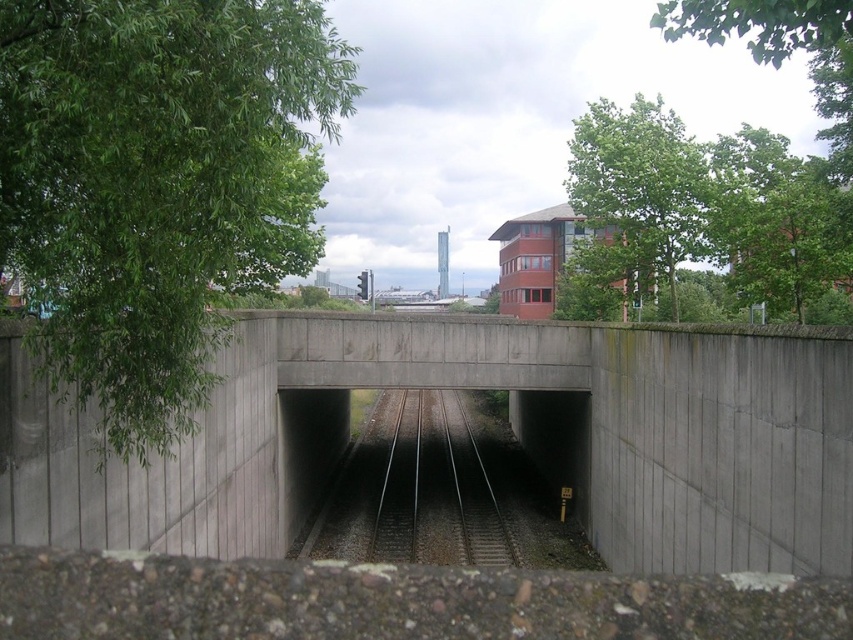
Question: Does green leafy tree at upper right have a larger size compared to white textured water tower at center?

Choices:
 (A) no
 (B) yes

Answer: (B)

Question: Is green leafy tree at upper right thinner than white textured water tower at center?

Choices:
 (A) yes
 (B) no

Answer: (B)

Question: Which object appears farthest from the camera in this image?

Choices:
 (A) green leafy tree at upper right
 (B) green leafy tree at upper center

Answer: (B)

Question: Is green leafy tree at left to the left of white textured water tower at center from the viewer's perspective?

Choices:
 (A) yes
 (B) no

Answer: (A)

Question: Which object is farther from the camera taking this photo?

Choices:
 (A) white textured water tower at center
 (B) green leafy tree at upper center
 (C) concrete bridge at center

Answer: (A)

Question: Estimate the real-world distances between objects in this image. Which object is closer to the concrete bridge at center?

Choices:
 (A) green leafy tree at upper center
 (B) green leafy tree at left

Answer: (B)